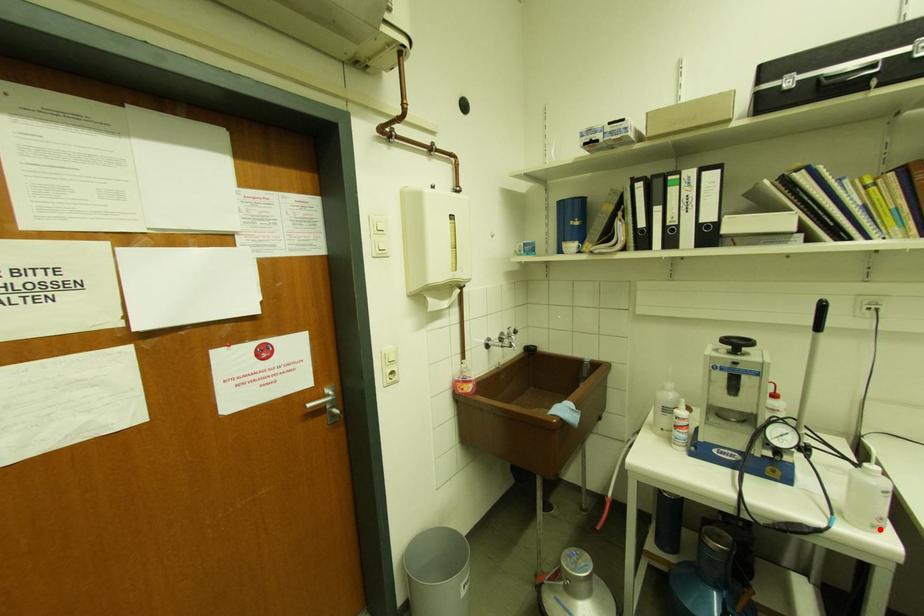
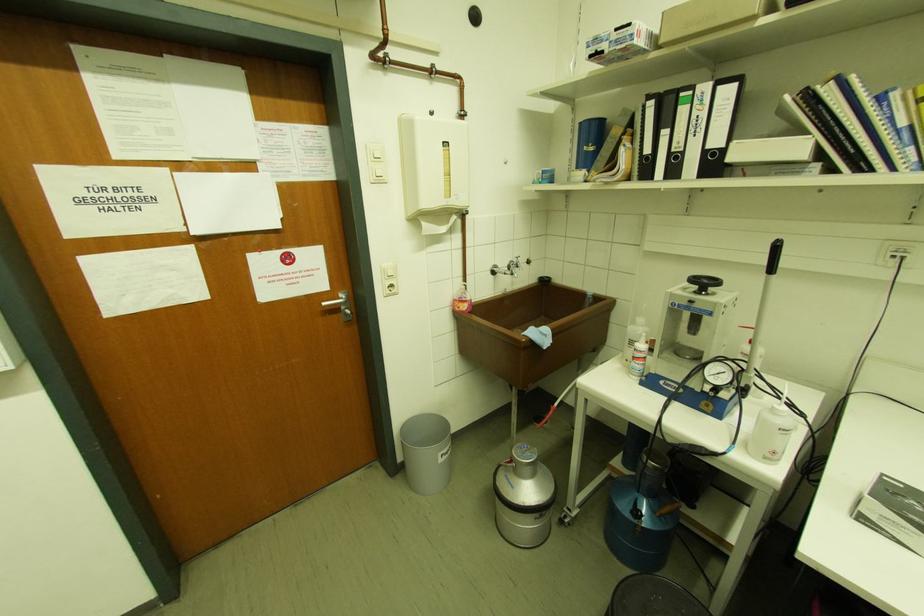
Question: I am providing you with two images of the same scene from different viewpoints. A red point is marked on the first image. Is the red point's position out of view in image 2?

Choices:
 (A) Yes
 (B) No

Answer: (B)